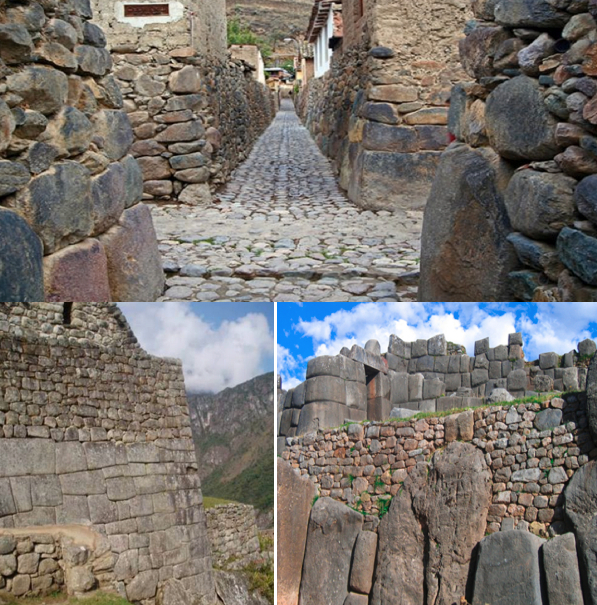
The image size is (597, 605). What are the coordinates of `small window` in the screenshot? It's located at (144, 14), (315, 50), (320, 45), (329, 31).